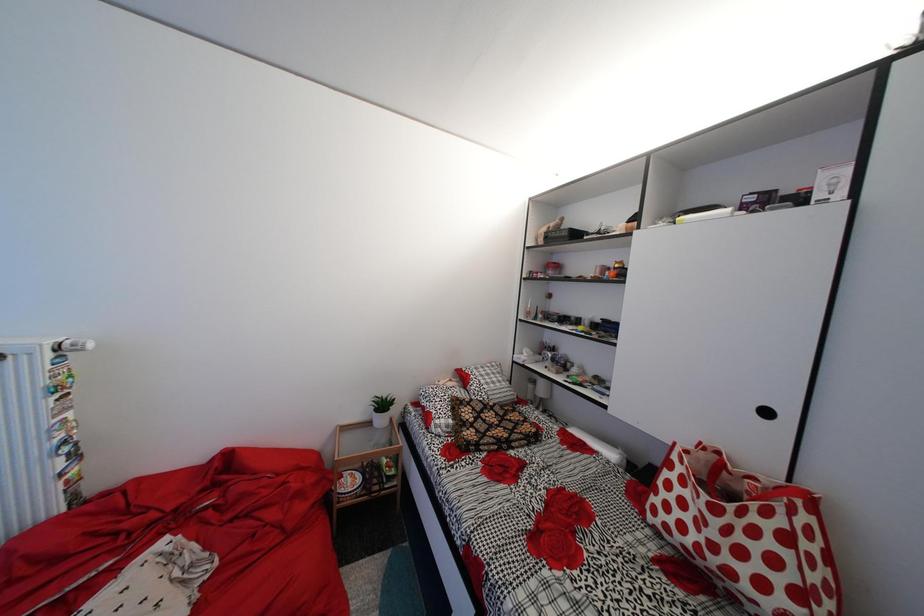
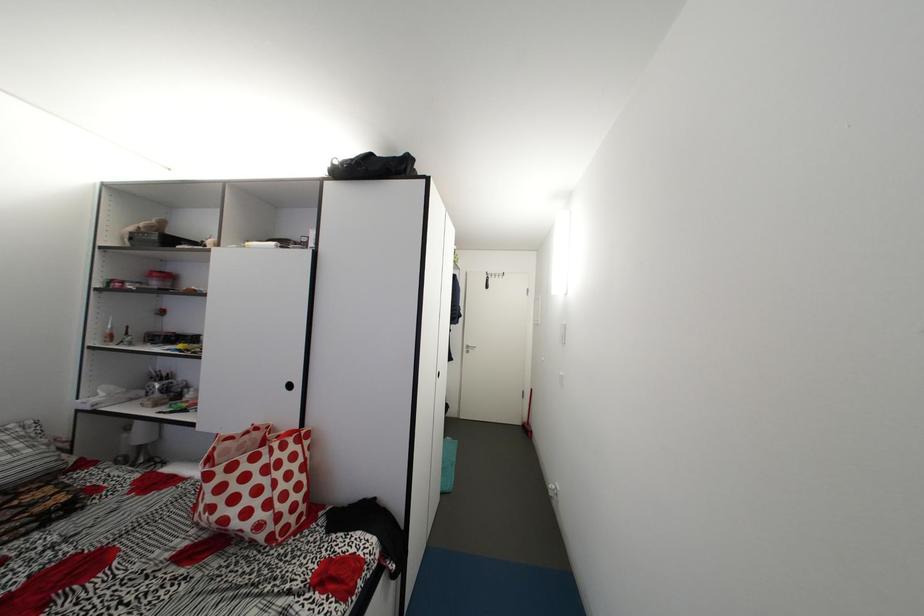
Question: The images are taken continuously from a first-person perspective. In which direction is your viewpoint rotating?

Choices:
 (A) Left
 (B) Right
 (C) Up
 (D) Down

Answer: (B)